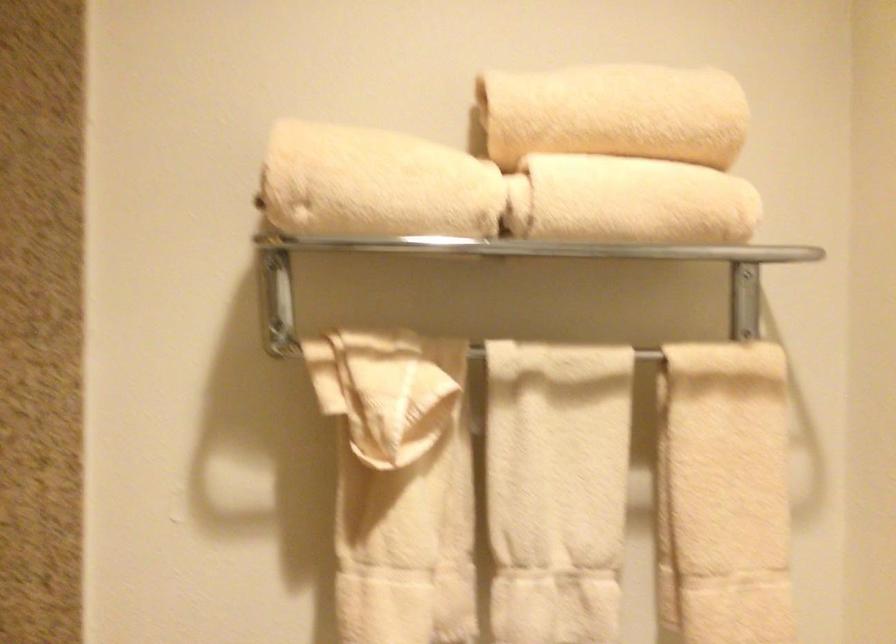
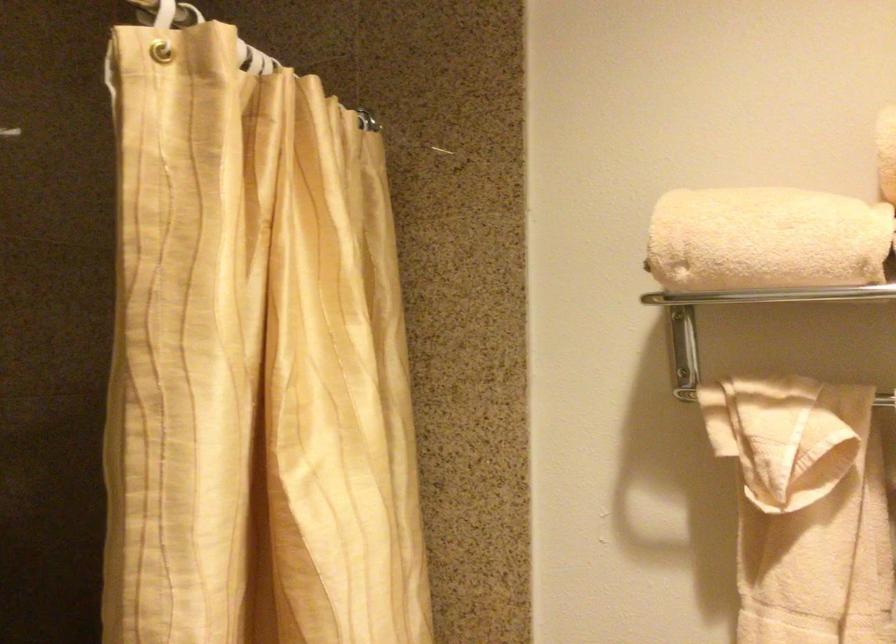
Where in the second image is the point corresponding to [399,440] from the first image?

(793, 486)